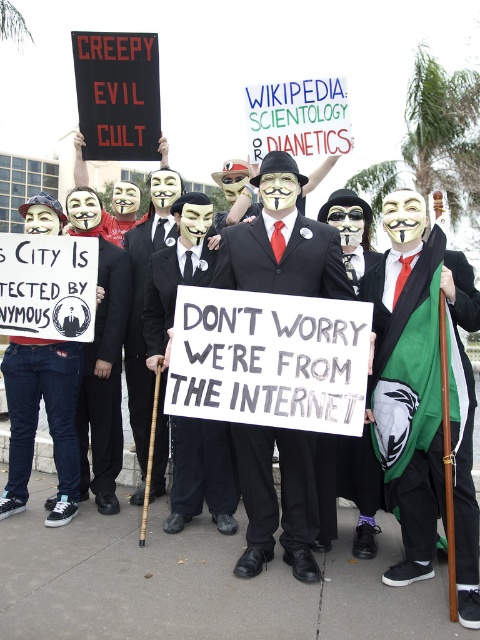
The width and height of the screenshot is (480, 640). Identify the location of matte black suit at center. (282, 243).

Can you confirm if matte black suit at center is positioned above denim jeans at lower left?

Actually, matte black suit at center is below denim jeans at lower left.

Does point (257, 541) come behind point (11, 349)?

No, it is in front of (11, 349).

The height and width of the screenshot is (640, 480). Identify the location of matte black suit at center. (282, 243).